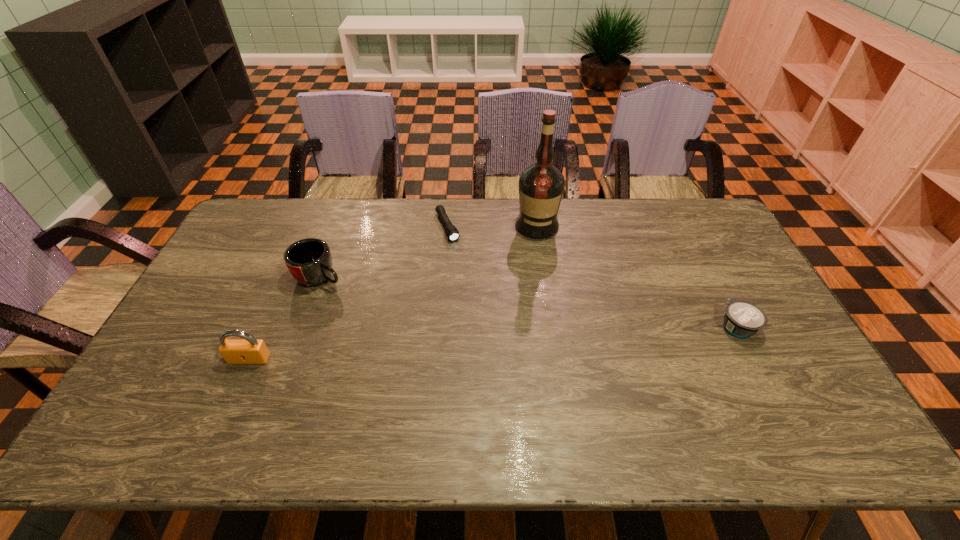
The width and height of the screenshot is (960, 540). Identify the location of vacant space that is in between the mug and the flashlight. (384, 252).

At what (x,y) coordinates should I click in order to perform the action: click on vacant space in between the liquor and the padlock. Please return your answer as a coordinate pair (x, y). Looking at the image, I should click on (394, 292).

Where is `free spot between the shortest object and the padlock`? free spot between the shortest object and the padlock is located at coordinates (348, 293).

The image size is (960, 540). What are the coordinates of `free point between the nearest object and the mug` in the screenshot? It's located at (285, 318).

Locate an element on the screen. This screenshot has width=960, height=540. free space between the fourth tallest object and the padlock is located at coordinates (493, 343).

Image resolution: width=960 pixels, height=540 pixels. What are the coordinates of `empty space between the flashlight and the third farthest object` in the screenshot? It's located at (384, 252).

This screenshot has width=960, height=540. What are the coordinates of `object that can be found as the fourth closest to the padlock` in the screenshot? It's located at (742, 319).

The image size is (960, 540). Identify the location of object that ranks as the closest to the rightmost object. (541, 185).

Identify the location of free space that satisfies the following two spatial constraints: 1. on the back side of the third object from left to right; 2. on the right side of the mug. (338, 227).

The width and height of the screenshot is (960, 540). What are the coordinates of `free spot that satisfies the following two spatial constraints: 1. on the front side of the third farthest object; 2. on the right side of the fourth farthest object` in the screenshot? It's located at (301, 327).